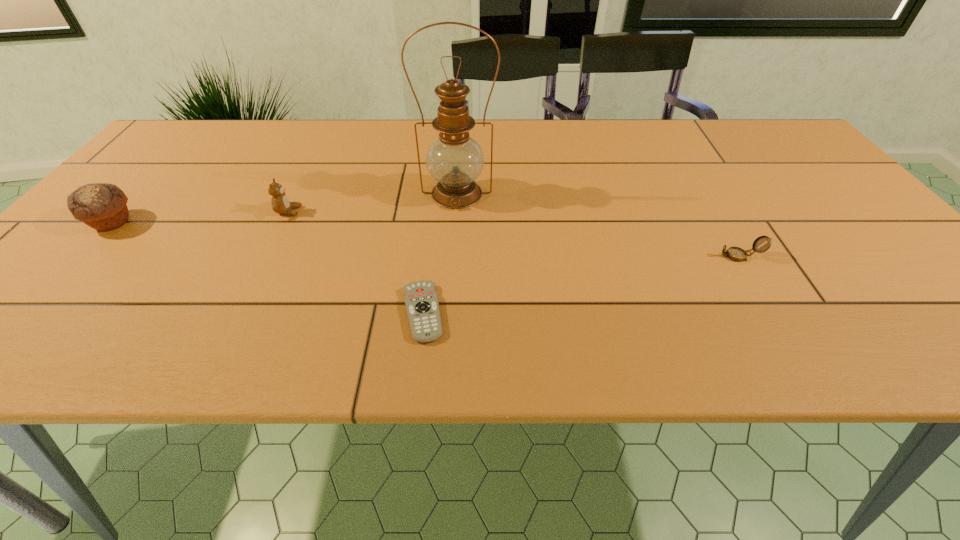
This screenshot has height=540, width=960. What are the coordinates of `the tallest object` in the screenshot? It's located at (455, 160).

You are a GUI agent. You are given a task and a screenshot of the screen. Output one action in this format:
    pyautogui.click(x=<x>, y=<y>)
    Task: Click on the leftmost object
    This screenshot has height=540, width=960.
    Given the screenshot: What is the action you would take?
    pyautogui.click(x=102, y=206)

At what (x,y) coordinates should I click in order to perform the action: click on teddy bear. Please return your answer as a coordinate pair (x, y). Looking at the image, I should click on (280, 203).

Locate an element on the screen. the second object from left to right is located at coordinates (280, 203).

Where is `the second shortest object`? Image resolution: width=960 pixels, height=540 pixels. the second shortest object is located at coordinates (737, 254).

The width and height of the screenshot is (960, 540). Identify the location of the rightmost object. pyautogui.click(x=737, y=254).

Find the location of `the shortest object`. the shortest object is located at coordinates (421, 301).

This screenshot has width=960, height=540. I want to click on the nearest object, so click(x=421, y=301).

What are the coordinates of `vacant space situated on the right of the oil lamp` in the screenshot? It's located at pyautogui.click(x=606, y=194).

This screenshot has height=540, width=960. Identify the location of vacant area situated on the right of the leftmost object. (171, 222).